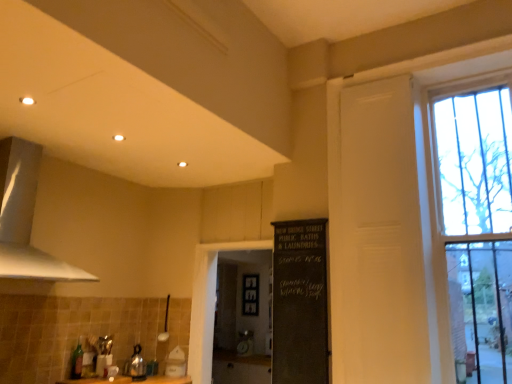
Where is `white matte exhaust hood at upper left`? white matte exhaust hood at upper left is located at coordinates (25, 218).

Describe the element at coordinates (240, 368) in the screenshot. I see `smooth wooden counter top at center` at that location.

Describe the element at coordinates (242, 318) in the screenshot. I see `black chalkboard at center, which is counted as the second screen door, starting from the front` at that location.

Identify the location of black chalkboard at center. (300, 303).

What do you see at coordinates (468, 215) in the screenshot? This screenshot has height=384, width=512. I see `white painted wood window at upper right` at bounding box center [468, 215].

Describe the element at coordinates (76, 362) in the screenshot. The width and height of the screenshot is (512, 384). I see `green glass bottle at lower left` at that location.

This screenshot has width=512, height=384. Find the location of `white matte exhaust hood at upper left`. white matte exhaust hood at upper left is located at coordinates (25, 218).

In terms of size, does black chalkboard at center appear bigger or smaller than white matte exhaust hood at upper left?

Clearly, black chalkboard at center is smaller in size than white matte exhaust hood at upper left.

Is black chalkboard at center surrounding white matte exhaust hood at upper left?

No, black chalkboard at center does not contain white matte exhaust hood at upper left.

Are black chalkboard at center and white matte exhaust hood at upper left beside each other?

No, black chalkboard at center is not beside white matte exhaust hood at upper left.

Is white matte door at right, the second screen door positioned from the left, turned away from green glass bottle at lower left?

No, white matte door at right, the second screen door positioned from the left, is not facing the opposite direction of green glass bottle at lower left.

Which object is closer to the camera, white matte door at right, acting as the 1th screen door starting from the right, or green glass bottle at lower left?

white matte door at right, acting as the 1th screen door starting from the right, is more forward.

Which object is thinner, white matte door at right, the first screen door positioned from the front, or green glass bottle at lower left?

green glass bottle at lower left.

Does point (341, 338) come farther from viewer compared to point (82, 353)?

No, (341, 338) is closer to viewer.

Is white matte exhaust hood at upper left far from black chalkboard at center?

white matte exhaust hood at upper left is far away from black chalkboard at center.

Is white matte exhaust hood at upper left behind black chalkboard at center?

No, white matte exhaust hood at upper left is in front of black chalkboard at center.

Does white matte exhaust hood at upper left have a greater width compared to black chalkboard at center?

Correct, the width of white matte exhaust hood at upper left exceeds that of black chalkboard at center.

From the image's perspective, which is above, white matte exhaust hood at upper left or black chalkboard at center?

white matte exhaust hood at upper left, from the image's perspective.

Between point (356, 136) and point (467, 165), which one is positioned in front?

The point (467, 165) is closer to the camera.

Between white matte door at right, placed as the 2th screen door when sorted from back to front, and white painted wood window at upper right, which one appears on the left side from the viewer's perspective?

white matte door at right, placed as the 2th screen door when sorted from back to front, is more to the left.

Is white matte door at right, acting as the 1th screen door starting from the right, oriented towards white painted wood window at upper right?

Yes.

Who is smaller, white matte door at right, the first screen door positioned from the front, or white painted wood window at upper right?

white matte door at right, the first screen door positioned from the front.

Based on their sizes in the image, would you say black chalkboard at center is bigger or smaller than white matte door at right, acting as the 1th screen door starting from the right?

black chalkboard at center is smaller than white matte door at right, acting as the 1th screen door starting from the right.

How far apart are black chalkboard at center and white matte door at right, the first screen door positioned from the front?

black chalkboard at center is 14.06 inches away from white matte door at right, the first screen door positioned from the front.

In terms of height, does black chalkboard at center look taller or shorter compared to white matte door at right, placed as the 2th screen door when sorted from back to front?

black chalkboard at center is shorter than white matte door at right, placed as the 2th screen door when sorted from back to front.

Considering the sizes of objects black chalkboard at center and white matte door at right, the first screen door positioned from the front, in the image provided, who is thinner, black chalkboard at center or white matte door at right, the first screen door positioned from the front,?

Thinner between the two is white matte door at right, the first screen door positioned from the front.

Is white matte exhaust hood at upper left surrounding black chalkboard at center, the 1th screen door viewed from the left?

No, black chalkboard at center, the 1th screen door viewed from the left, is located outside of white matte exhaust hood at upper left.

From the picture: Looking at the image, does white matte exhaust hood at upper left seem bigger or smaller compared to black chalkboard at center, which is the 2th screen door in right-to-left order?

In the image, white matte exhaust hood at upper left appears to be larger than black chalkboard at center, which is the 2th screen door in right-to-left order.

Which screen door is the 1st one when counting from the right side of the white matte exhaust hood at upper left? Please provide its 2D coordinates.

[(242, 318)]

Does white matte door at right, the second screen door positioned from the left, have a greater width compared to black chalkboard at center?

In fact, white matte door at right, the second screen door positioned from the left, might be narrower than black chalkboard at center.

Considering the sizes of objects white matte door at right, the first screen door positioned from the front, and black chalkboard at center in the image provided, who is shorter, white matte door at right, the first screen door positioned from the front, or black chalkboard at center?

black chalkboard at center.

From the picture: Between white matte door at right, placed as the 2th screen door when sorted from back to front, and black chalkboard at center, which one has smaller size?

With smaller size is black chalkboard at center.

What's the angular difference between white matte door at right, the first screen door positioned from the front, and black chalkboard at center's facing directions?

The facing directions of white matte door at right, the first screen door positioned from the front, and black chalkboard at center are 1.47 degrees apart.

This screenshot has width=512, height=384. What are the coordinates of `bulletin board beneath the white matte exhaust hood at upper left (from a real-world perspective)` in the screenshot? It's located at (300, 303).

Identify the location of the 2nd screen door to the right of the green glass bottle at lower left, starting your count from the anchor. (376, 236).

Looking at the image, which one is located closer to white painted wood window at upper right, smooth wooden counter top at center or black chalkboard at center, which is counted as the second screen door, starting from the front?

The object closer to white painted wood window at upper right is smooth wooden counter top at center.

Which object lies nearer to the anchor point smooth wooden counter top at center, white matte exhaust hood at upper left or green glass bottle at lower left?

The object closer to smooth wooden counter top at center is green glass bottle at lower left.

Based on their spatial positions, is black chalkboard at center or black chalkboard at center, which is counted as the second screen door, starting from the front, closer to smooth wooden counter top at center?

black chalkboard at center, which is counted as the second screen door, starting from the front, is positioned closer to the anchor smooth wooden counter top at center.

Which object lies further to the anchor point black chalkboard at center, the 1th screen door viewed from the left, white matte exhaust hood at upper left or smooth wooden counter top at center?

white matte exhaust hood at upper left lies further to black chalkboard at center, the 1th screen door viewed from the left, than the other object.

Considering their positions, is black chalkboard at center, which is the 1th screen door in back-to-front order, positioned further to green glass bottle at lower left than white painted wood window at upper right?

black chalkboard at center, which is the 1th screen door in back-to-front order, is positioned further to the anchor green glass bottle at lower left.

From the image, which object appears to be nearer to white matte exhaust hood at upper left, white matte door at right, acting as the 1th screen door starting from the right, or green glass bottle at lower left?

green glass bottle at lower left is closer to white matte exhaust hood at upper left.

Considering their positions, is white painted wood window at upper right positioned further to white matte exhaust hood at upper left than black chalkboard at center, which is counted as the second screen door, starting from the front?

black chalkboard at center, which is counted as the second screen door, starting from the front.

From the image, which object appears to be nearer to green glass bottle at lower left, smooth wooden counter top at center or white matte door at right, acting as the 1th screen door starting from the right?

white matte door at right, acting as the 1th screen door starting from the right.

This screenshot has height=384, width=512. In order to click on bottle between white matte exhaust hood at upper left and black chalkboard at center, the 1th screen door viewed from the left in this screenshot , I will do `click(76, 362)`.

At what (x,y) coordinates should I click in order to perform the action: click on bottle between black chalkboard at center and smooth wooden counter top at center from front to back. Please return your answer as a coordinate pair (x, y). Looking at the image, I should click on (76, 362).

Where is `bulletin board between white matte door at right, the first screen door positioned from the front, and smooth wooden counter top at center in the front-back direction`? Image resolution: width=512 pixels, height=384 pixels. bulletin board between white matte door at right, the first screen door positioned from the front, and smooth wooden counter top at center in the front-back direction is located at coordinates 300,303.

Where is `screen door situated between black chalkboard at center, the 1th screen door viewed from the left, and white painted wood window at upper right from left to right`? screen door situated between black chalkboard at center, the 1th screen door viewed from the left, and white painted wood window at upper right from left to right is located at coordinates (376, 236).